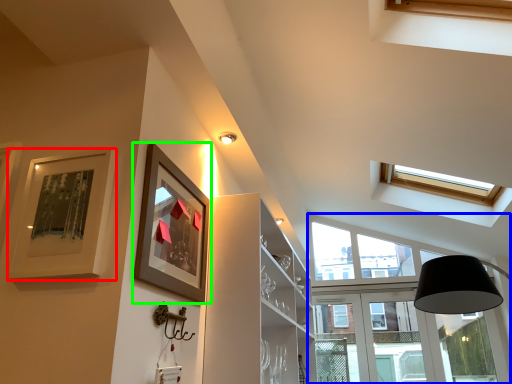
Question: Based on their relative distances, which object is farther from picture frame (highlighted by a red box)? Choose from window (highlighted by a blue box) and picture frame (highlighted by a green box).

Choices:
 (A) window
 (B) picture frame

Answer: (A)